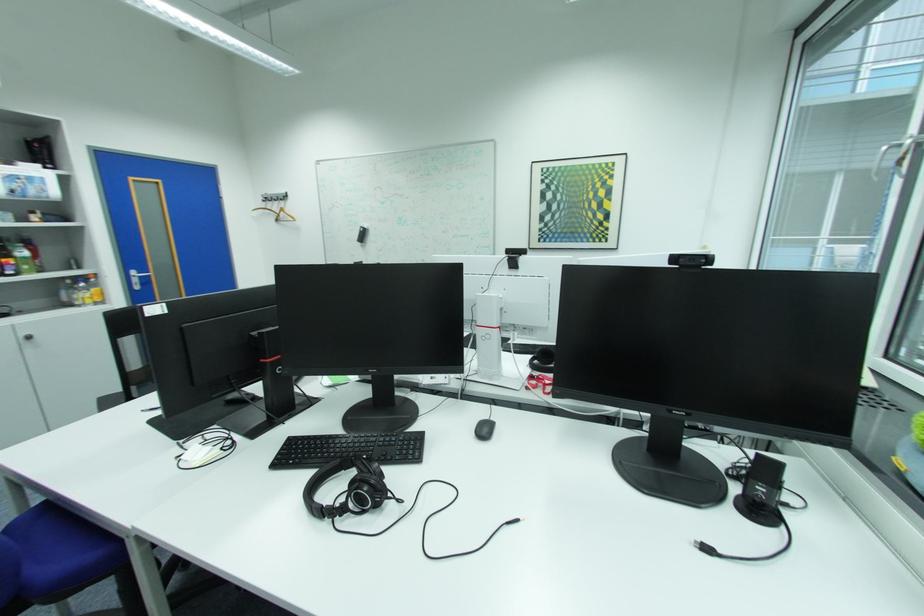
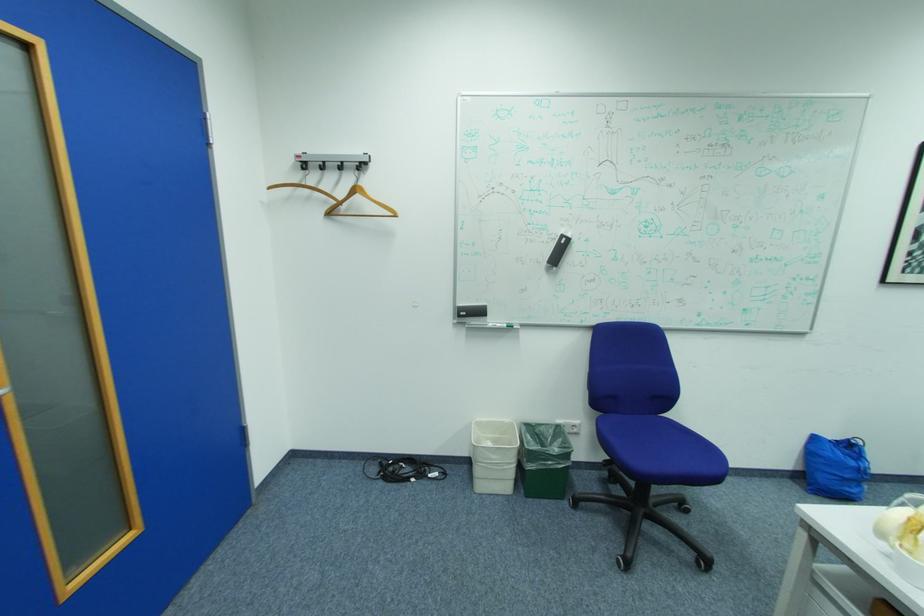
In a continuous first-person perspective shot, in which direction is the camera moving?

The cameraman moved toward left, forward.